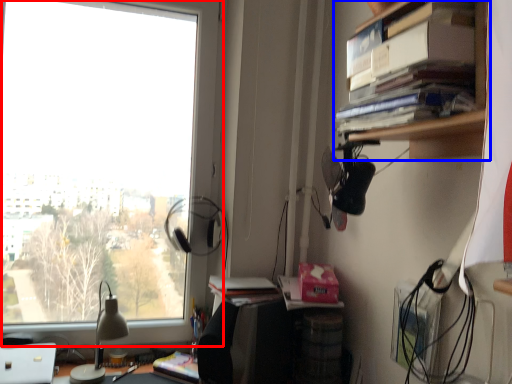
Question: Which object appears farthest to the camera in this image, window (highlighted by a red box) or cabinetry (highlighted by a blue box)?

Choices:
 (A) window
 (B) cabinetry

Answer: (A)